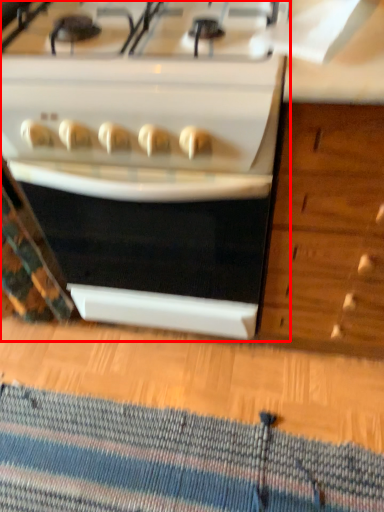
Question: From the image's perspective, where is kitchen appliance (annotated by the red box) located in relation to doormat in the image?

Choices:
 (A) above
 (B) below

Answer: (A)